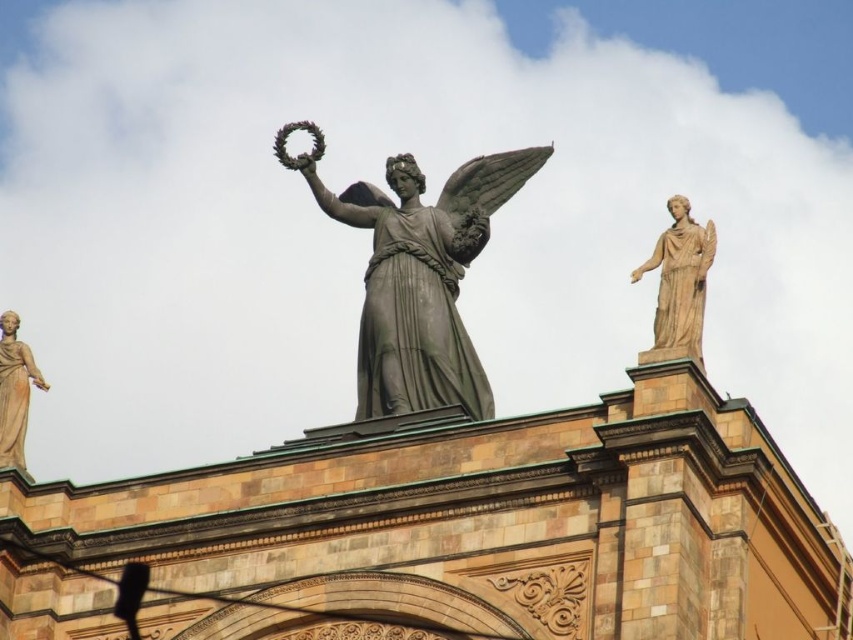
Which is above, matte gray statue at center or beige marble statue at upper right?

matte gray statue at center is higher up.

Which is in front, point (436, 298) or point (692, 266)?

Point (692, 266) is more forward.

Where is `matte gray statue at center`? The image size is (853, 640). matte gray statue at center is located at coordinates (416, 273).

Who is lower down, beige marble statue at upper right or matte beige statue at left?

matte beige statue at left is below.

Who is more distant from viewer, (689, 227) or (22, 355)?

The point (22, 355) is more distant.

The height and width of the screenshot is (640, 853). What do you see at coordinates (679, 284) in the screenshot? I see `beige marble statue at upper right` at bounding box center [679, 284].

At what (x,y) coordinates should I click in order to perform the action: click on beige marble statue at upper right. Please return your answer as a coordinate pair (x, y). This screenshot has height=640, width=853. Looking at the image, I should click on (679, 284).

Does matte gray statue at center have a greater height compared to matte beige statue at left?

Yes, matte gray statue at center is taller than matte beige statue at left.

Does matte gray statue at center appear on the right side of matte beige statue at left?

Yes, matte gray statue at center is to the right of matte beige statue at left.

What are the coordinates of `matte gray statue at center` in the screenshot? It's located at (416, 273).

Locate an element on the screen. Image resolution: width=853 pixels, height=640 pixels. matte gray statue at center is located at coordinates (416, 273).